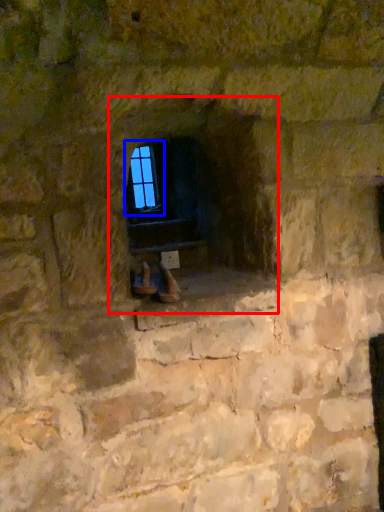
Question: Among these objects, which one is farthest to the camera, fireplace (highlighted by a red box) or window (highlighted by a blue box)?

Choices:
 (A) fireplace
 (B) window

Answer: (B)